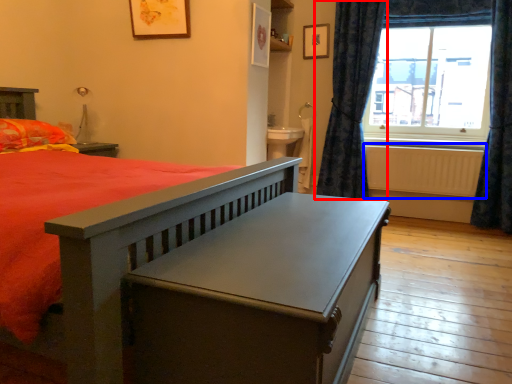
Question: Which point is further to the camera, curtain (highlighted by a red box) or radiator (highlighted by a blue box)?

Choices:
 (A) curtain
 (B) radiator

Answer: (B)